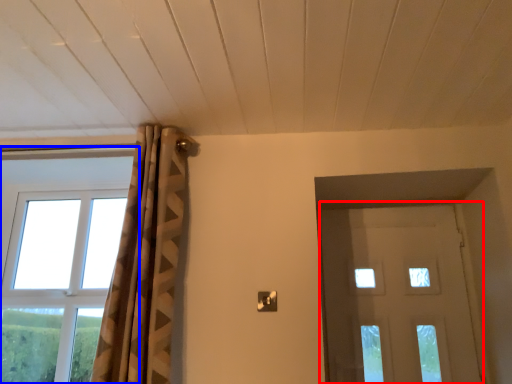
Question: Which of the following is the closest to the observer, door (highlighted by a red box) or window (highlighted by a blue box)?

Choices:
 (A) door
 (B) window

Answer: (A)